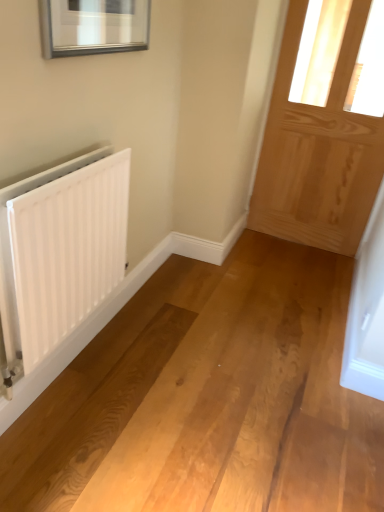
Question: From a real-world perspective, is white matte radiator at left above or below natural wood door at right?

Choices:
 (A) above
 (B) below

Answer: (B)

Question: Visually, is white matte radiator at left positioned to the left or to the right of natural wood door at right?

Choices:
 (A) right
 (B) left

Answer: (B)

Question: In terms of height, does white matte radiator at left look taller or shorter compared to natural wood door at right?

Choices:
 (A) short
 (B) tall

Answer: (A)

Question: In the image, is natural wood door at right on the left side or the right side of white matte radiator at left?

Choices:
 (A) right
 (B) left

Answer: (A)

Question: Is point (336, 133) positioned closer to the camera than point (41, 286)?

Choices:
 (A) farther
 (B) closer

Answer: (A)

Question: From the image's perspective, relative to white matte radiator at left, is natural wood door at right above or below?

Choices:
 (A) above
 (B) below

Answer: (A)

Question: From their relative heights in the image, would you say natural wood door at right is taller or shorter than white matte radiator at left?

Choices:
 (A) short
 (B) tall

Answer: (B)